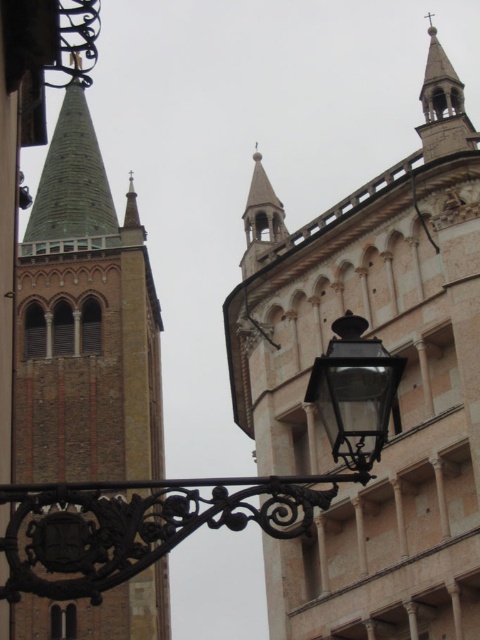
Question: Estimate the real-world distances between objects in this image. Which object is farther from the smooth beige tower at center?

Choices:
 (A) smooth stone spire at upper right
 (B) black wrought iron street light at center
 (C) green stone tower at left

Answer: (C)

Question: Does black wrought iron street light at center have a lesser width compared to smooth stone spire at upper right?

Choices:
 (A) no
 (B) yes

Answer: (A)

Question: Does green stone tower at left appear on the right side of black wrought iron street light at center?

Choices:
 (A) no
 (B) yes

Answer: (A)

Question: Which point appears closest to the camera in this image?

Choices:
 (A) (19, 132)
 (B) (434, 515)
 (C) (90, 593)
 (D) (440, 72)

Answer: (C)

Question: Which of these objects is positioned closest to the green stone tower at left?

Choices:
 (A) black wrought iron street light at center
 (B) smooth beige tower at center

Answer: (A)

Question: Observing the image, what is the correct spatial positioning of smooth beige tower at center in reference to black wrought iron street light at center?

Choices:
 (A) above
 (B) below

Answer: (A)